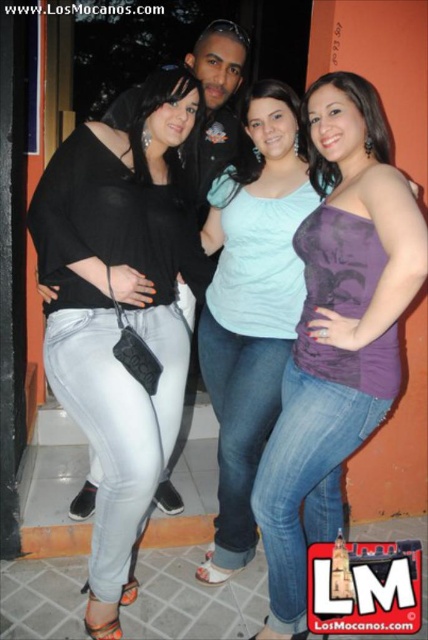
Is black matte top at left smaller than purple matte tank top at center?

No.

Who is more forward, [208,266] or [336,179]?

Point [336,179]

What are the coordinates of `black matte top at left` in the screenshot? It's located at (x=121, y=310).